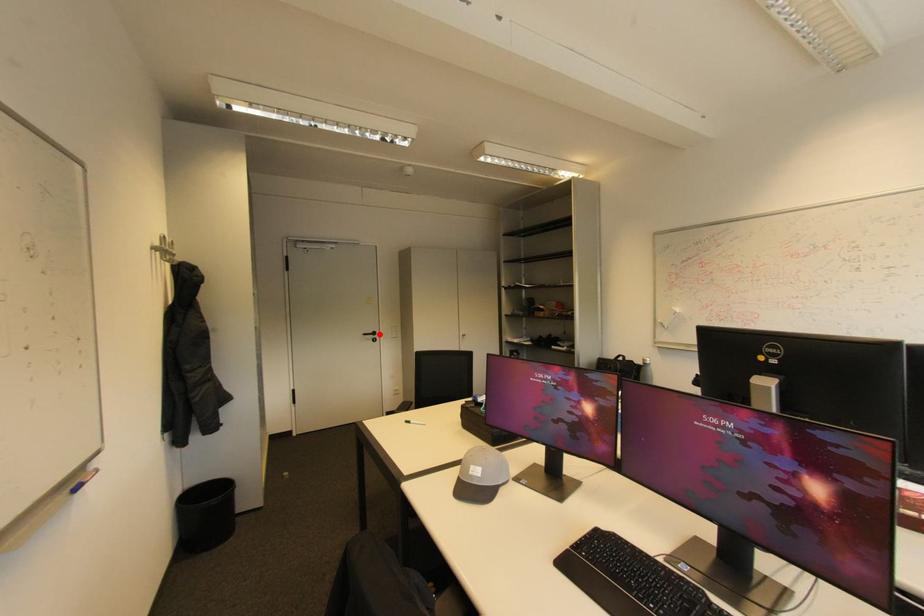
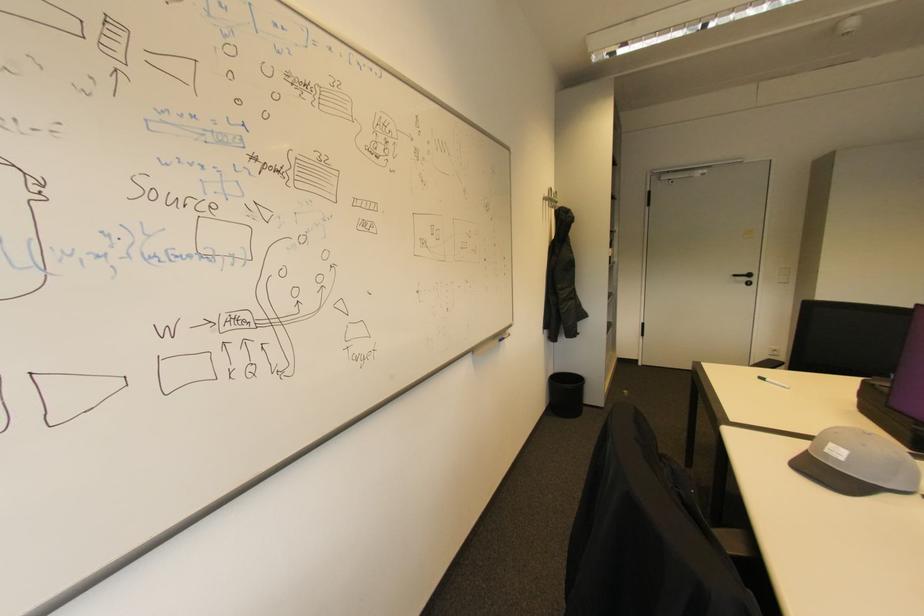
The point at the highlighted location is marked in the first image. Where is the corresponding point in the second image?

(755, 276)